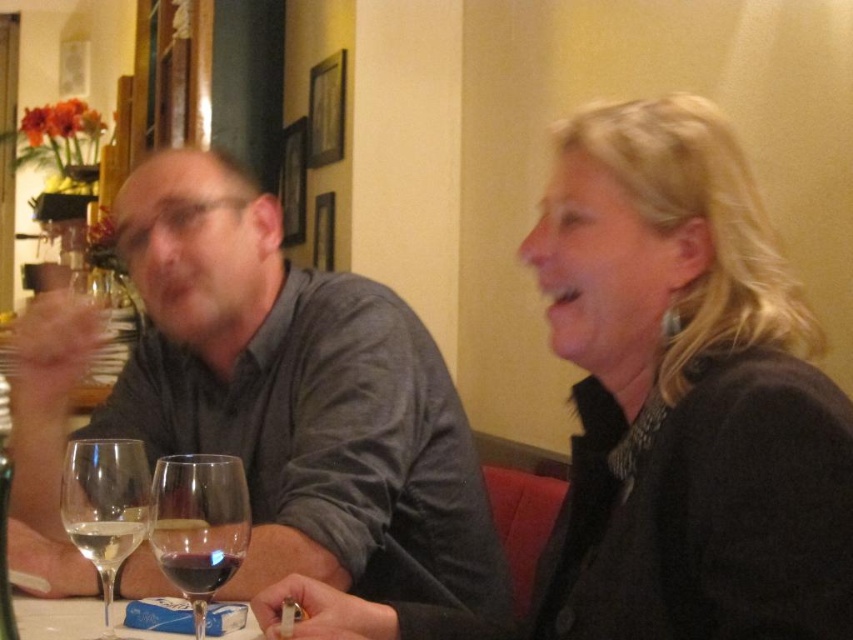
Is clear glass wine glass at lower left below white paper napkin at lower center?

No.

Can you confirm if clear glass wine glass at lower left is wider than white paper napkin at lower center?

In fact, clear glass wine glass at lower left might be narrower than white paper napkin at lower center.

This screenshot has height=640, width=853. What do you see at coordinates (105, 506) in the screenshot? I see `clear glass wine glass at lower left` at bounding box center [105, 506].

This screenshot has height=640, width=853. I want to click on clear glass wine glass at lower left, so click(x=105, y=506).

Can you confirm if gray matte shirt at left is positioned to the right of white paper napkin at lower center?

Correct, you'll find gray matte shirt at left to the right of white paper napkin at lower center.

Between gray matte shirt at left and white paper napkin at lower center, which one has more height?

gray matte shirt at left

Between point (363, 532) and point (44, 632), which one is positioned in front?

Point (44, 632) is more forward.

Identify the location of gray matte shirt at left. (299, 396).

Is matte black jacket at center to the right of clear glass wine at lower left from the viewer's perspective?

Indeed, matte black jacket at center is positioned on the right side of clear glass wine at lower left.

Image resolution: width=853 pixels, height=640 pixels. What are the coordinates of `matte black jacket at center` in the screenshot? It's located at (665, 410).

This screenshot has height=640, width=853. I want to click on matte black jacket at center, so click(665, 410).